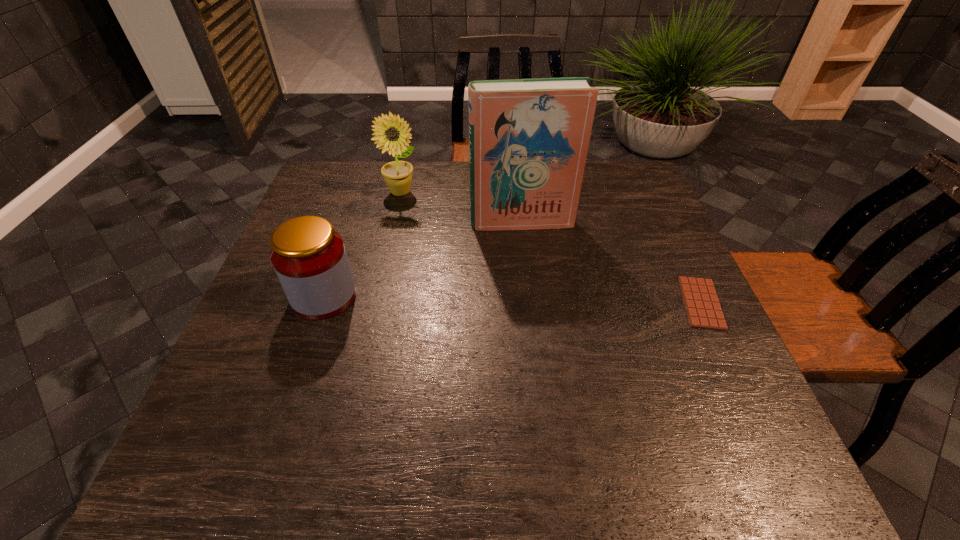
Identify the location of vacant space on the desktop that is between the second shortest object and the candy bar and is positioned on the face of the third shortest object. Image resolution: width=960 pixels, height=540 pixels. (497, 300).

At what (x,y) coordinates should I click in order to perform the action: click on free space on the desktop that is between the second shortest object and the candy bar and is positioned on the cover of the tallest object. Please return your answer as a coordinate pair (x, y). The width and height of the screenshot is (960, 540). Looking at the image, I should click on pos(539,300).